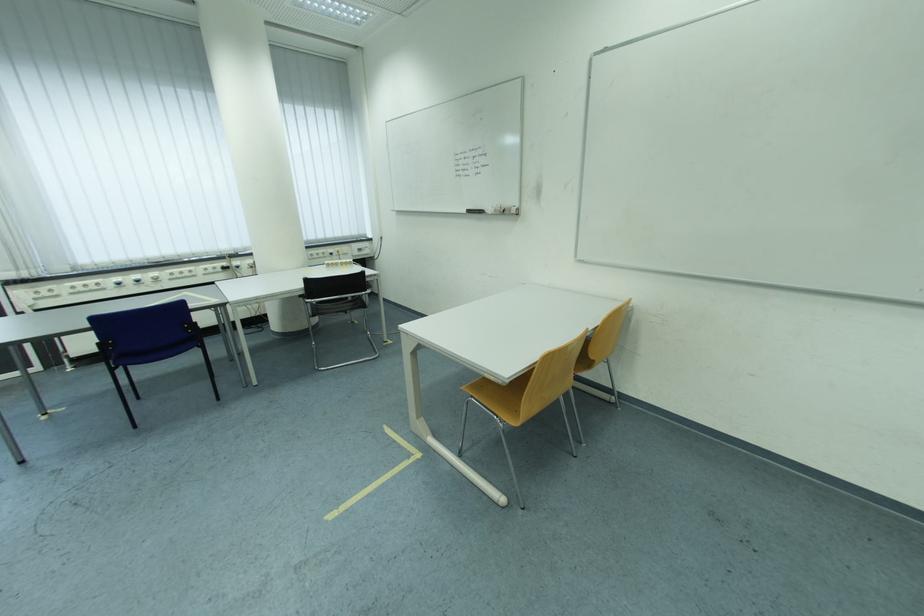
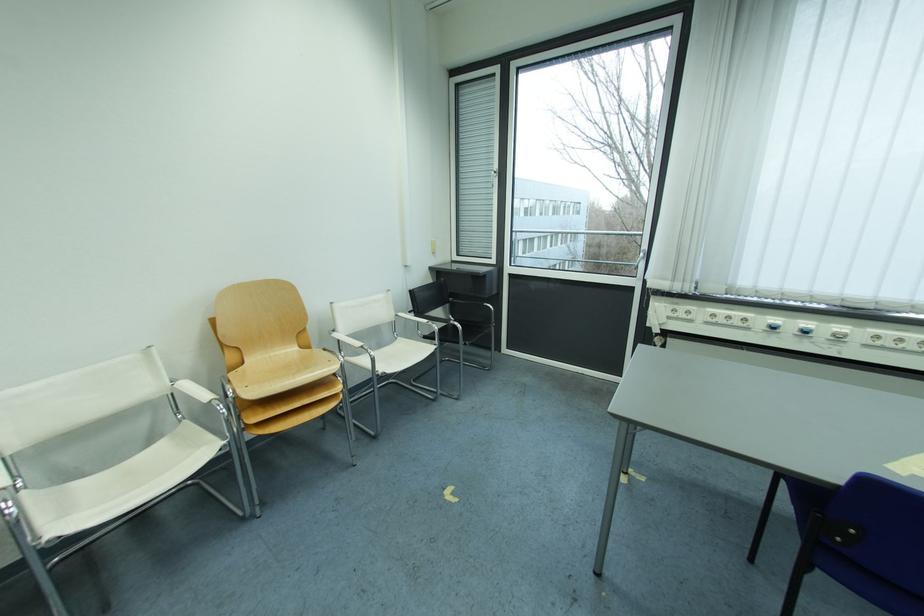
Find the pixel in the second image that matches the point at 162,276 in the first image.

(849, 330)